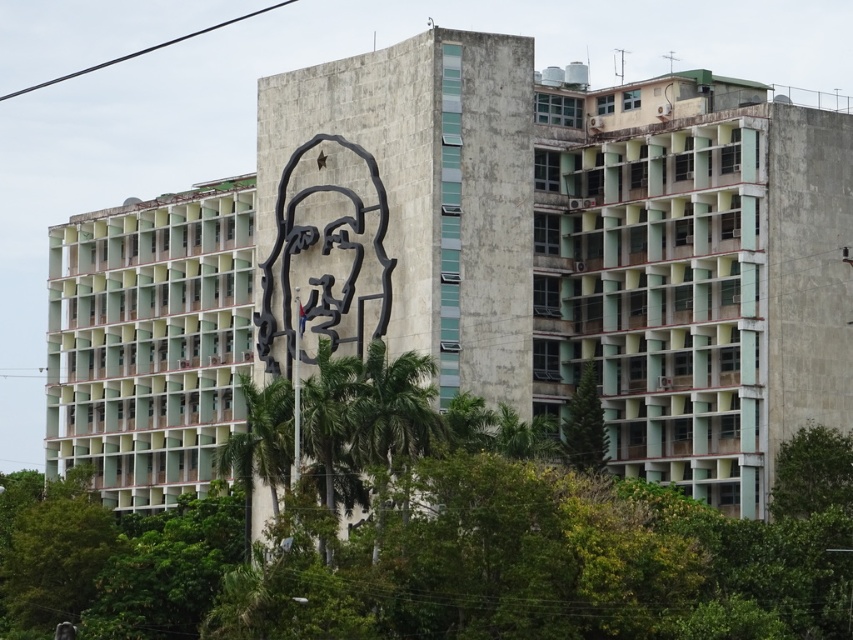
You are standing in front of the building and want to take a photo of the green leafy tree at center. Where should you position yourself to ensure the tree is centered in your camera view?

The green leafy tree at center is located at the coordinates 0.847 on the x axis and 0.508 on the y axis, so to center it in your camera view, position yourself directly in front of the building at those coordinates.